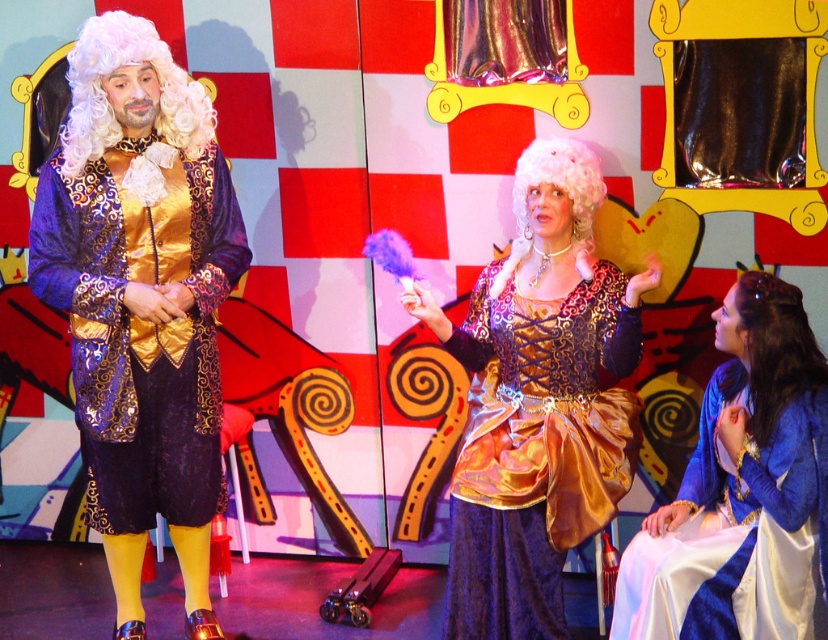
Question: Which point is closer to the camera taking this photo?

Choices:
 (A) (691, 589)
 (B) (191, 113)
 (C) (576, 204)
 (D) (574, 472)

Answer: (A)

Question: Which object appears farthest from the camera in this image?

Choices:
 (A) white curly wig at left
 (B) white curly wig at center
 (C) satin blue dress at center
 (D) dark brown silky wig at lower right

Answer: (B)

Question: Based on their relative distances, which object is farther from the satin blue dress at center?

Choices:
 (A) white curly wig at center
 (B) dark brown silky wig at lower right
 (C) shiny gold vest at center
 (D) gold satin dress at center

Answer: (C)

Question: Is shiny gold vest at center to the right of white curly wig at left from the viewer's perspective?

Choices:
 (A) yes
 (B) no

Answer: (A)

Question: Where is satin blue dress at center located in relation to white curly wig at center in the image?

Choices:
 (A) below
 (B) above

Answer: (A)

Question: Does dark brown silky wig at lower right have a greater width compared to white curly wig at center?

Choices:
 (A) yes
 (B) no

Answer: (B)